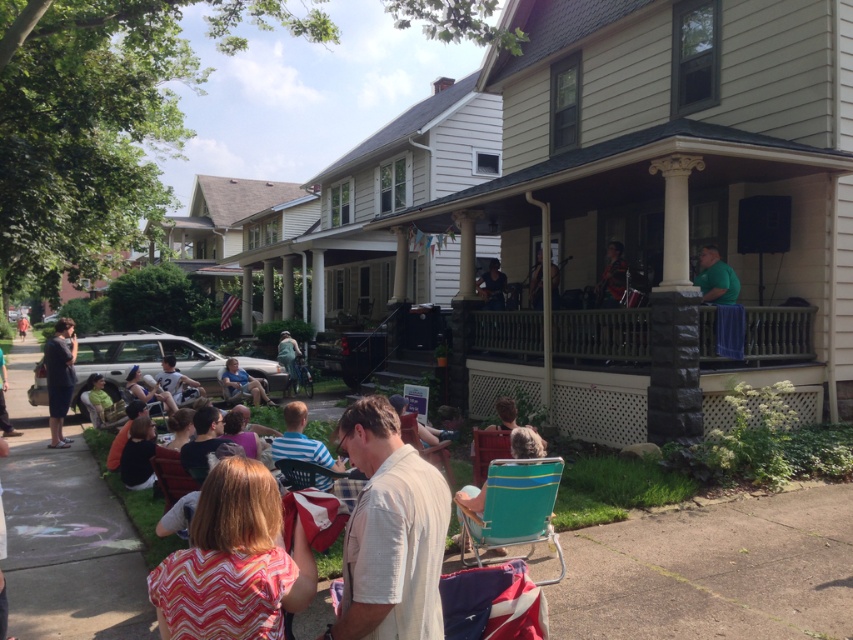
Question: Where is white striped shirt at center located in relation to matte blue shirt at lower center in the image?

Choices:
 (A) below
 (B) above

Answer: (B)

Question: Is dark gray pants at left bigger than blue striped shirt at center?

Choices:
 (A) no
 (B) yes

Answer: (B)

Question: Which object is the farthest from the multicolored zigzag shirt at lower left?

Choices:
 (A) green t-shirt at lower left
 (B) gray hair at center

Answer: (A)

Question: Which object appears farthest from the camera in this image?

Choices:
 (A) green matte shirt at upper right
 (B) gray hair at center
 (C) dark blue shirt at center
 (D) blue striped shirt at center

Answer: (C)

Question: Which point is closer to the camera?

Choices:
 (A) green matte shirt at upper right
 (B) matte black shirt at center

Answer: (A)

Question: Observing the image, what is the correct spatial positioning of multicolored zigzag shirt at lower left in reference to matte black shirt at center?

Choices:
 (A) above
 (B) below

Answer: (B)